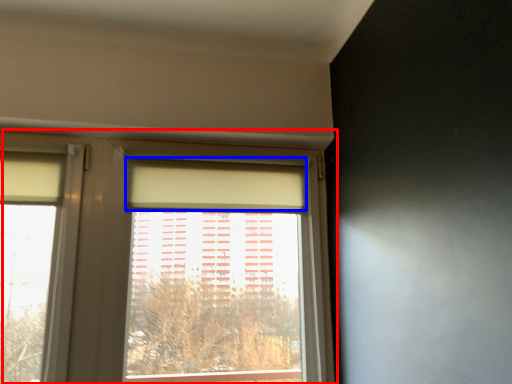
Question: Which of the following is the closest to the observer, window (highlighted by a red box) or curtain (highlighted by a blue box)?

Choices:
 (A) window
 (B) curtain

Answer: (A)